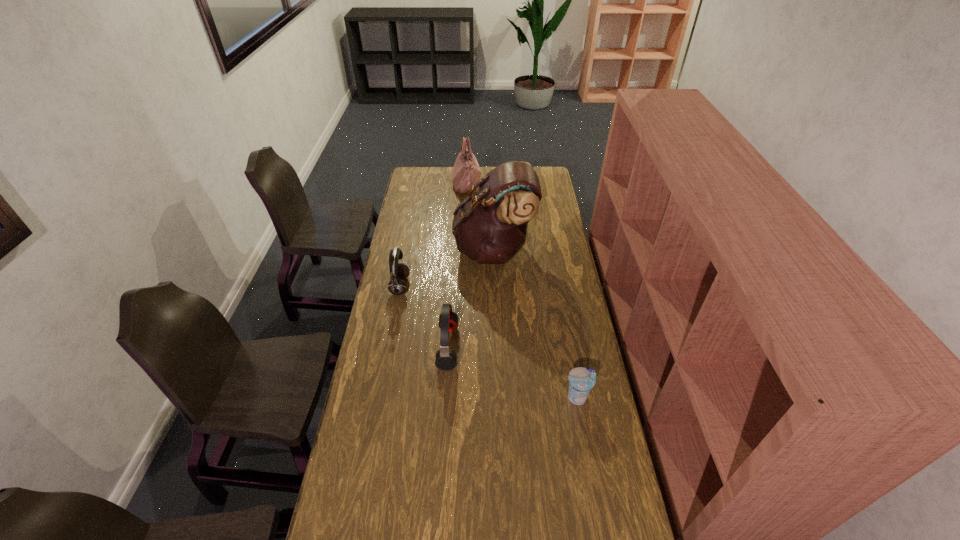
You are a GUI agent. You are given a task and a screenshot of the screen. Output one action in this format:
    pyautogui.click(x=<x>, y=<y>)
    Task: Click on the free region at the far left corner of the desktop
    
    Given the screenshot: What is the action you would take?
    pyautogui.click(x=420, y=180)

Locate an element on the screen. This screenshot has height=540, width=960. free space that is in between the satchel and the shortest object is located at coordinates (536, 323).

The height and width of the screenshot is (540, 960). Find the location of `empty space between the satchel and the yogurt`. empty space between the satchel and the yogurt is located at coordinates (536, 323).

Image resolution: width=960 pixels, height=540 pixels. In order to click on vacant point located between the satchel and the left earphone in this screenshot , I will do `click(446, 268)`.

Locate an element on the screen. This screenshot has width=960, height=540. free space that is in between the farther earphone and the tallest object is located at coordinates (446, 268).

I want to click on blank region between the left earphone and the second shortest object, so click(423, 316).

Locate an element on the screen. Image resolution: width=960 pixels, height=540 pixels. vacant region between the left earphone and the nearest object is located at coordinates (489, 342).

Find the location of a particular element. free space that is in between the nearer earphone and the shortest object is located at coordinates (513, 372).

Locate an element on the screen. Image resolution: width=960 pixels, height=540 pixels. object that can be found as the fourth closest to the leftmost object is located at coordinates (581, 380).

The image size is (960, 540). I want to click on object that ranks as the second closest to the tallest object, so click(466, 172).